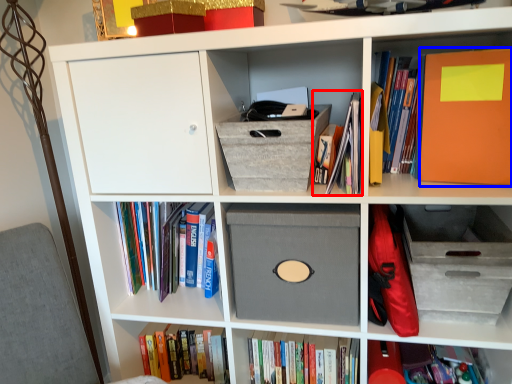
Question: Which object is further to the camera taking this photo, book (highlighted by a red box) or paperback book (highlighted by a blue box)?

Choices:
 (A) book
 (B) paperback book

Answer: (A)